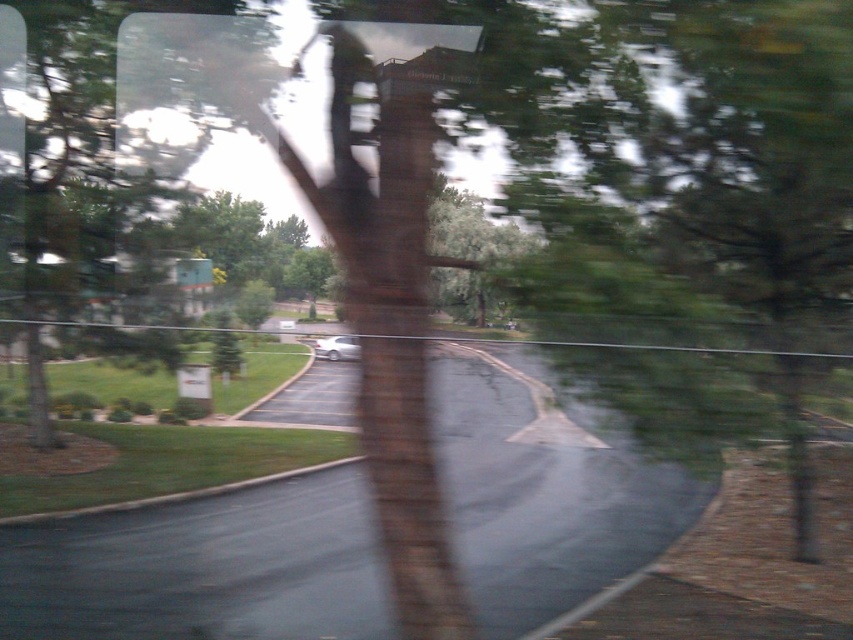
Between green leafy tree at center and satin silver car at center, which one is positioned higher?

green leafy tree at center is higher up.

Does point (456, 312) come closer to viewer compared to point (350, 346)?

No.

Where is `green leafy tree at center`? This screenshot has width=853, height=640. green leafy tree at center is located at coordinates (471, 228).